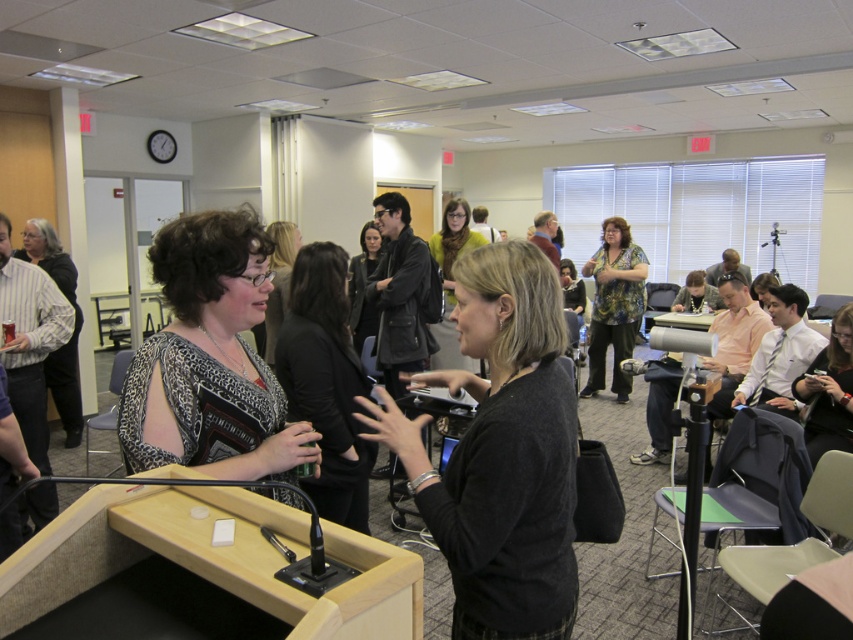
Is point (268, 380) more distant than point (323, 307)?

No, it is in front of (323, 307).

Is leopard print dress at center closer to the viewer compared to matte black dress at center?

Yes, leopard print dress at center is in front of matte black dress at center.

This screenshot has height=640, width=853. What do you see at coordinates (209, 358) in the screenshot?
I see `leopard print dress at center` at bounding box center [209, 358].

At what (x,y) coordinates should I click in order to perform the action: click on leopard print dress at center. Please return your answer as a coordinate pair (x, y). The image size is (853, 640). Looking at the image, I should click on [209, 358].

Can you confirm if leopard print dress at center is smaller than floral-patterned blouse at center?

Yes.

Between leopard print dress at center and floral-patterned blouse at center, which one has more height?

floral-patterned blouse at center

Between point (202, 454) and point (614, 292), which one is positioned in front?

Point (202, 454) is in front.

Where is `leopard print dress at center`? The height and width of the screenshot is (640, 853). leopard print dress at center is located at coordinates (209, 358).

Who is shorter, matte black phone at lower right or leather jacket at center?

matte black phone at lower right is shorter.

Is matte black phone at lower right positioned at the back of leather jacket at center?

No, matte black phone at lower right is in front of leather jacket at center.

Is point (817, 353) farther from viewer compared to point (367, 301)?

No, (817, 353) is closer to viewer.

The height and width of the screenshot is (640, 853). I want to click on matte black phone at lower right, so click(828, 390).